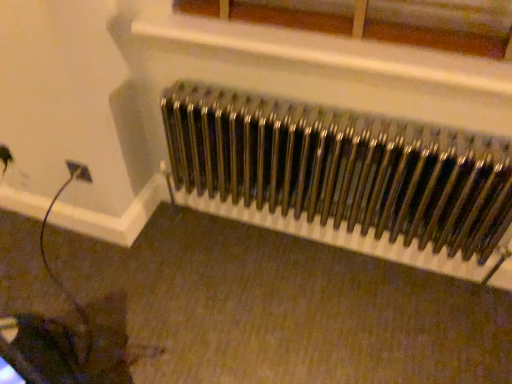
Question: From the image's perspective, is metallic radiator at center positioned above or below metallic white radiator at upper center?

Choices:
 (A) below
 (B) above

Answer: (A)

Question: From a real-world perspective, relative to metallic white radiator at upper center, is metallic radiator at center vertically above or below?

Choices:
 (A) above
 (B) below

Answer: (B)

Question: Do you think metallic radiator at center is within metallic white radiator at upper center, or outside of it?

Choices:
 (A) outside
 (B) inside

Answer: (A)

Question: Is point (442, 11) closer or farther from the camera than point (253, 114)?

Choices:
 (A) farther
 (B) closer

Answer: (B)

Question: In the image, is metallic white radiator at upper center positioned in front of or behind metallic radiator at center?

Choices:
 (A) front
 (B) behind

Answer: (A)

Question: Do you think metallic white radiator at upper center is within metallic radiator at center, or outside of it?

Choices:
 (A) outside
 (B) inside

Answer: (A)

Question: Considering the positions of metallic white radiator at upper center and metallic radiator at center in the image, is metallic white radiator at upper center taller or shorter than metallic radiator at center?

Choices:
 (A) short
 (B) tall

Answer: (A)